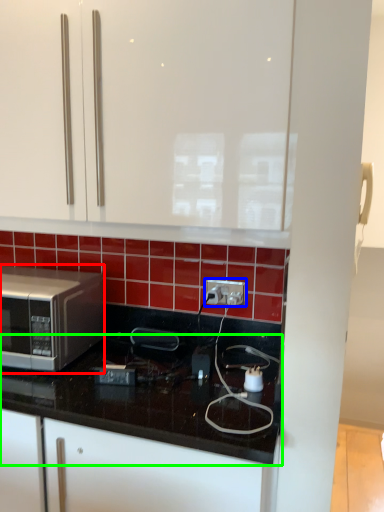
Question: Which object is positioned farthest from microwave oven (highlighted by a red box)? Select from electric outlet (highlighted by a blue box) and countertop (highlighted by a green box).

Choices:
 (A) electric outlet
 (B) countertop

Answer: (A)